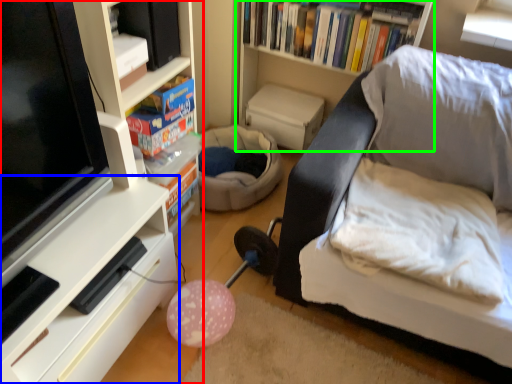
Question: Estimate the real-world distances between objects in this image. Which object is closer to shelf (highlighted by a red box), shelf (highlighted by a blue box) or bookshelf (highlighted by a green box)?

Choices:
 (A) shelf
 (B) bookshelf

Answer: (A)